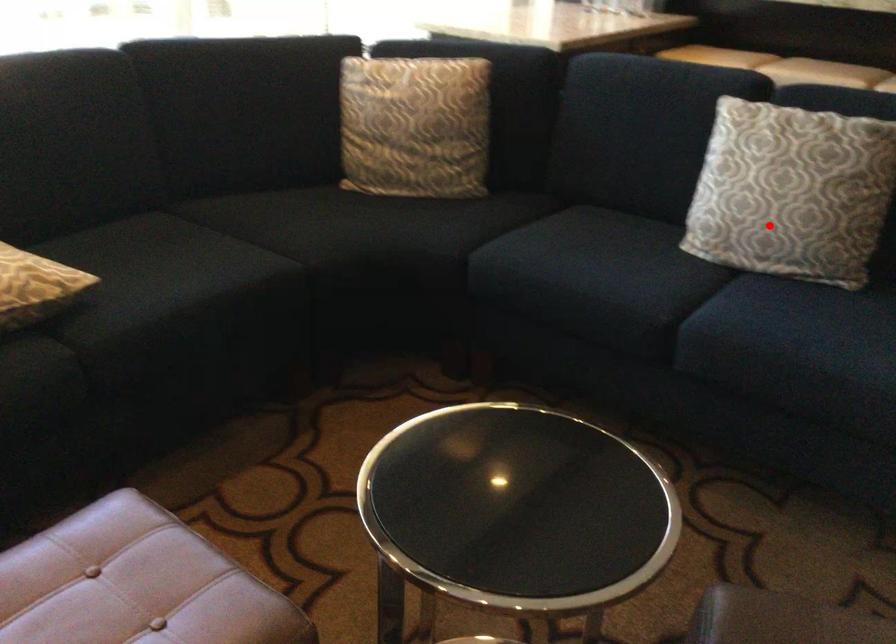
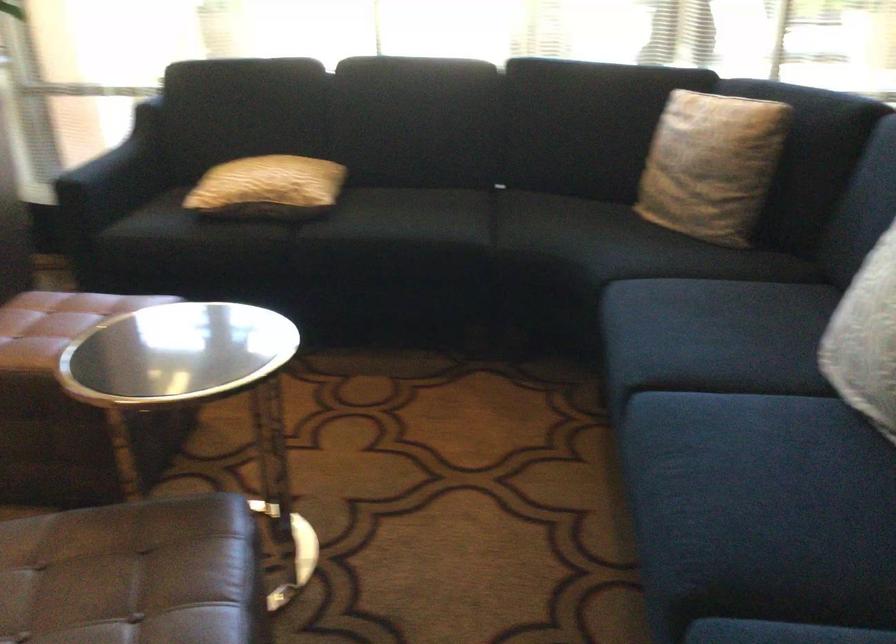
Where in the second image is the point corresponding to the highlighted location from the first image?

(866, 339)